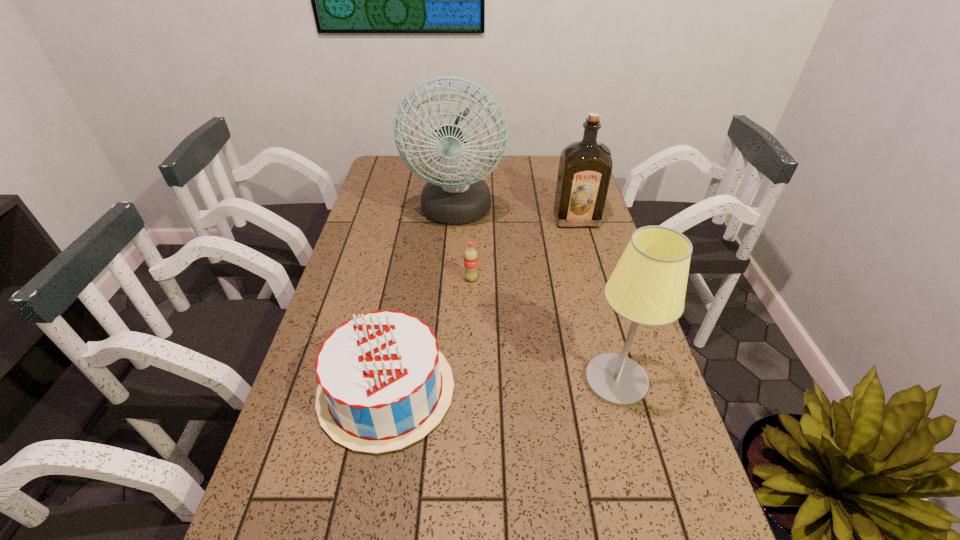
This screenshot has width=960, height=540. I want to click on fan, so click(457, 195).

Identify the location of table lamp. (648, 286).

Locate an element on the screen. The image size is (960, 540). liquor is located at coordinates (585, 167).

At what (x,y) coordinates should I click in order to perform the action: click on birthday cake. Please return your answer as a coordinate pair (x, y). Looking at the image, I should click on click(x=383, y=384).

What are the coordinates of `soda` in the screenshot? It's located at (470, 256).

Identify the location of the shortest object. Image resolution: width=960 pixels, height=540 pixels. [470, 256].

Identify the location of free location located 0.340m in front of the tallest object where the airflow is directed. (448, 319).

Where is `vacant space located 0.190m on the back of the table lamp`? Image resolution: width=960 pixels, height=540 pixels. vacant space located 0.190m on the back of the table lamp is located at coordinates (594, 300).

Where is `free point located 0.270m on the label of the liquor`? free point located 0.270m on the label of the liquor is located at coordinates (595, 285).

The image size is (960, 540). In order to click on vacant point located 0.080m on the back of the birthday cake in this screenshot , I will do `click(400, 315)`.